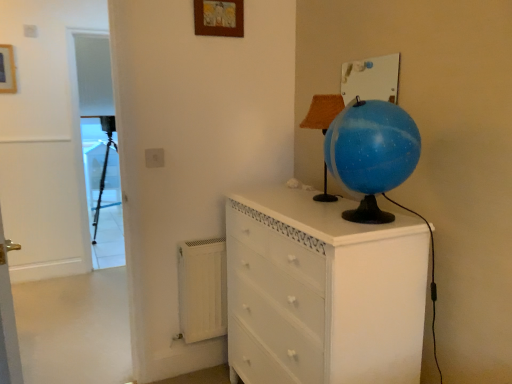
Where is `free spot behind burlap-textured lampshade at upper center`? Image resolution: width=512 pixels, height=384 pixels. free spot behind burlap-textured lampshade at upper center is located at coordinates (303, 187).